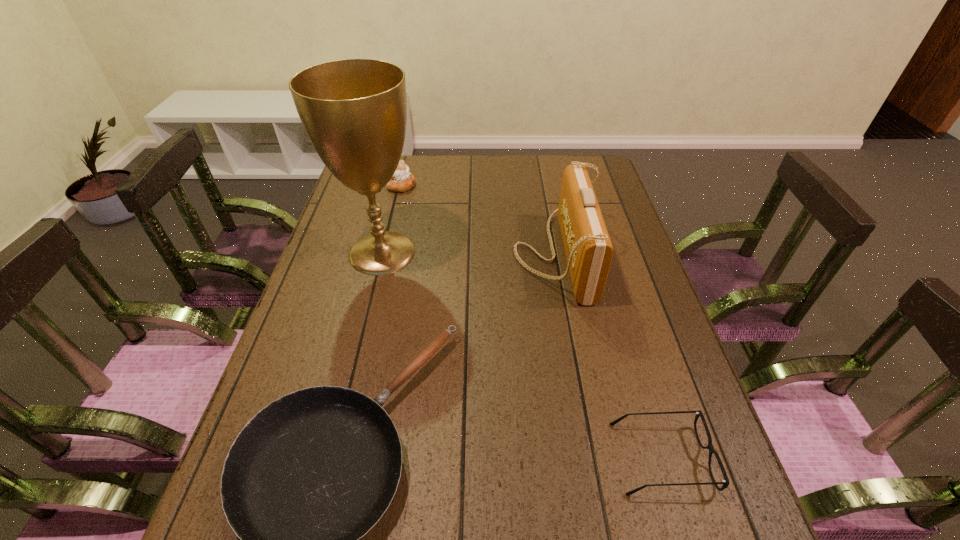
The image size is (960, 540). In order to click on trophy cup in this screenshot , I will do `click(354, 111)`.

In order to click on handbag in this screenshot , I will do `click(588, 248)`.

Where is `the farthest object`? the farthest object is located at coordinates (402, 180).

Where is `the third shortest object`? The image size is (960, 540). the third shortest object is located at coordinates (402, 180).

Locate an element on the screen. The image size is (960, 540). spectacles is located at coordinates pos(725,482).

In order to click on blank space located on the front of the trophy cup in this screenshot , I will do `click(348, 392)`.

At what (x,y) coordinates should I click in order to perform the action: click on vacant space located 0.340m on the decorative side of the handbag. Please return your answer as a coordinate pair (x, y). Looking at the image, I should click on (397, 254).

This screenshot has width=960, height=540. I want to click on vacant space located 0.310m on the decorative side of the handbag, so click(x=407, y=254).

Image resolution: width=960 pixels, height=540 pixels. In order to click on free space located on the decorative side of the handbag in this screenshot , I will do `click(404, 254)`.

You are a GUI agent. You are given a task and a screenshot of the screen. Output one action in this format:
    pyautogui.click(x=<x>, y=<y>)
    Task: Click on the vacant position located on the right of the pastry
    
    Given the screenshot: What is the action you would take?
    pyautogui.click(x=455, y=185)